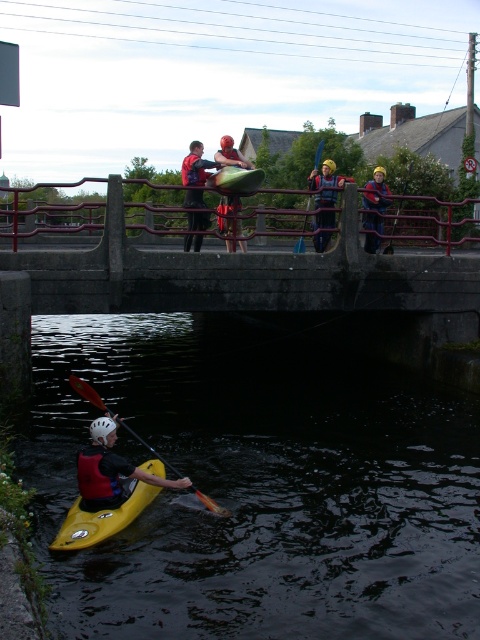
You are a safety inspector checking the distance between the concrete bridge at center and the blue fabric life jacket at center. According to safety regulations, the minimum safe distance between such objects should be 15 feet. Is the current distance compliant with the regulations?

The concrete bridge at center is 14.90 feet away from the blue fabric life jacket at center. Since 14.90 feet is less than the required 15 feet, the current distance does not comply with the safety regulations.

You are a water safety instructor assessing the scene. You notice the blue fabric life jacket at center and the matte black kayak at upper center. Which object takes up more area in the image?

The matte black kayak at upper center takes up more area than the blue fabric life jacket at center because the blue fabric life jacket at center occupies less space than matte black kayak at upper center.

You are a safety inspector checking the equipment in the image. You need to ensure that all life jackets are taller than the kayaks they are paired with. Are the blue fabric life jacket at center and matte black kayak at upper center compliant with this requirement?

The blue fabric life jacket at center is shorter than matte black kayak at upper center, so they are not compliant with the requirement that life jackets must be taller than the kayaks they are paired with.